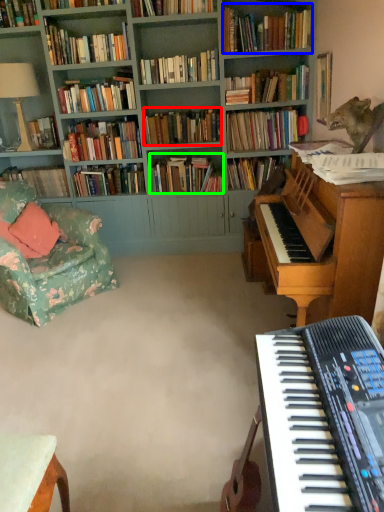
Question: Which object is positioned farthest from book (highlighted by a red box)? Select from book (highlighted by a blue box) and book (highlighted by a green box).

Choices:
 (A) book
 (B) book

Answer: (A)